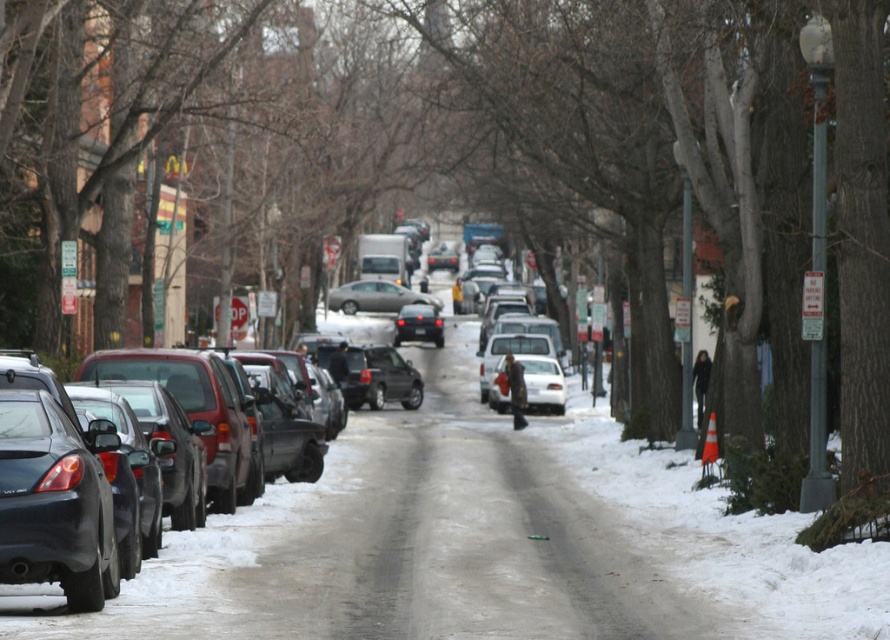
Who is taller, matte black sedan at left or satin silver sedan at center?

matte black sedan at left

Does matte black sedan at left appear over satin silver sedan at center?

Actually, matte black sedan at left is below satin silver sedan at center.

Where is `matte black sedan at left`? matte black sedan at left is located at coordinates (328, 518).